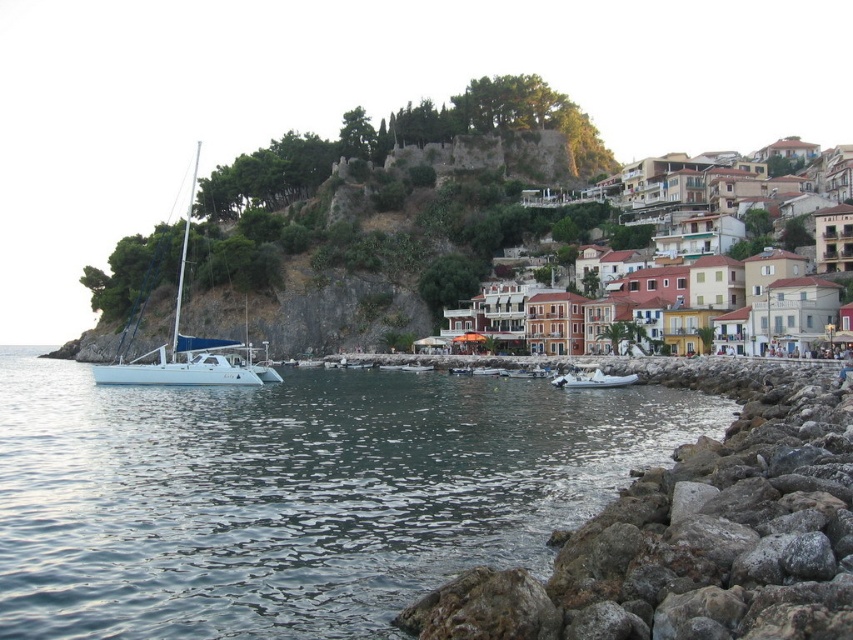
Question: Which of the following is the farthest from the observer?

Choices:
 (A) (486, 580)
 (B) (460, 234)

Answer: (B)

Question: Does green leafy hillside at upper center appear under white rubber dinghy at lower center?

Choices:
 (A) yes
 (B) no

Answer: (B)

Question: Among these points, which one is farthest from the camera?

Choices:
 (A) (589, 380)
 (B) (740, 292)

Answer: (B)

Question: Can you confirm if rockyrough stonerocky shore at lower right is positioned above white glossy sailboat at left?

Choices:
 (A) no
 (B) yes

Answer: (A)

Question: Among these objects, which one is nearest to the camera?

Choices:
 (A) multicolored painted houses at center
 (B) white rubber dinghy at lower center
 (C) green leafy hillside at upper center
 (D) rockyrough stonerocky shore at lower right

Answer: (D)

Question: Can you confirm if green leafy hillside at upper center is positioned above white glossy sailboat at left?

Choices:
 (A) yes
 (B) no

Answer: (B)